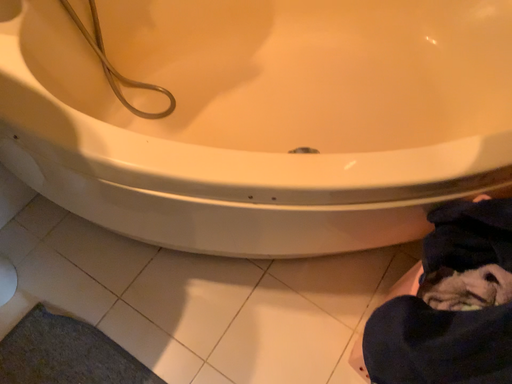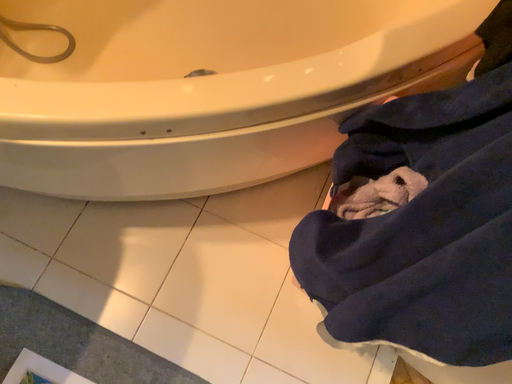
Question: How did the camera likely rotate when shooting the video?

Choices:
 (A) rotated upward
 (B) rotated downward

Answer: (B)